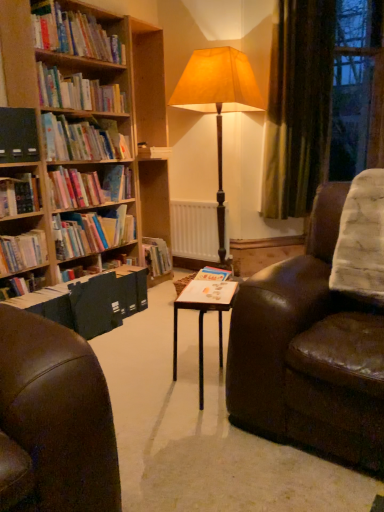
Question: Considering the relative positions of white wooden table at center and hardcover books at left, the 4th book viewed from the top, in the image provided, is white wooden table at center behind hardcover books at left, the 4th book viewed from the top,?

Choices:
 (A) no
 (B) yes

Answer: (A)

Question: Considering the relative positions of white wooden table at center and hardcover books at left, the 4th book viewed from the top, in the image provided, is white wooden table at center to the right of hardcover books at left, the 4th book viewed from the top, from the viewer's perspective?

Choices:
 (A) yes
 (B) no

Answer: (A)

Question: Considering the relative sizes of white wooden table at center and hardcover books at left, marked as the fourth book in a bottom-to-top arrangement, in the image provided, is white wooden table at center thinner than hardcover books at left, marked as the fourth book in a bottom-to-top arrangement,?

Choices:
 (A) no
 (B) yes

Answer: (A)

Question: Is white wooden table at center positioned in front of hardcover books at left, the 4th book viewed from the top?

Choices:
 (A) yes
 (B) no

Answer: (A)

Question: Is white wooden table at center far from hardcover books at left, marked as the fourth book in a bottom-to-top arrangement?

Choices:
 (A) no
 (B) yes

Answer: (B)

Question: Could hardcover books at left, the 4th book viewed from the top, be considered to be inside white wooden table at center?

Choices:
 (A) no
 (B) yes

Answer: (A)

Question: Would you say matte paper at center, the 2th paperback book viewed from the left, is a long distance from black matte book at left, which ranks as the second paperback book in bottom-to-top order?

Choices:
 (A) no
 (B) yes

Answer: (B)

Question: From a real-world perspective, is matte paper at center, acting as the second paperback book starting from the back, positioned over black matte book at left, positioned as the 2th paperback book in right-to-left order, based on gravity?

Choices:
 (A) yes
 (B) no

Answer: (B)

Question: Considering the relative positions of matte paper at center, which appears as the first paperback book when ordered from the bottom, and black matte book at left, positioned as the 2th paperback book in right-to-left order, in the image provided, is matte paper at center, which appears as the first paperback book when ordered from the bottom, in front of black matte book at left, positioned as the 2th paperback book in right-to-left order,?

Choices:
 (A) yes
 (B) no

Answer: (A)

Question: Is matte paper at center, which is the 2th paperback book from top to bottom, with black matte book at left, positioned as the 2th paperback book in right-to-left order?

Choices:
 (A) yes
 (B) no

Answer: (B)

Question: Can black matte book at left, which ranks as the first paperback book in back-to-front order, be found inside matte paper at center, the 2th paperback book viewed from the left?

Choices:
 (A) no
 (B) yes

Answer: (A)

Question: Considering the relative sizes of matte paper at center, the 1th paperback book in the right-to-left sequence, and black matte book at left, arranged as the 2th paperback book when viewed from the front, in the image provided, is matte paper at center, the 1th paperback book in the right-to-left sequence, shorter than black matte book at left, arranged as the 2th paperback book when viewed from the front,?

Choices:
 (A) yes
 (B) no

Answer: (A)

Question: From a real-world perspective, is hardcover books at upper left, positioned as the 1th book in top-to-bottom order, beneath hardcover book at upper left, which ranks as the 5th book in bottom-to-top order?

Choices:
 (A) no
 (B) yes

Answer: (A)